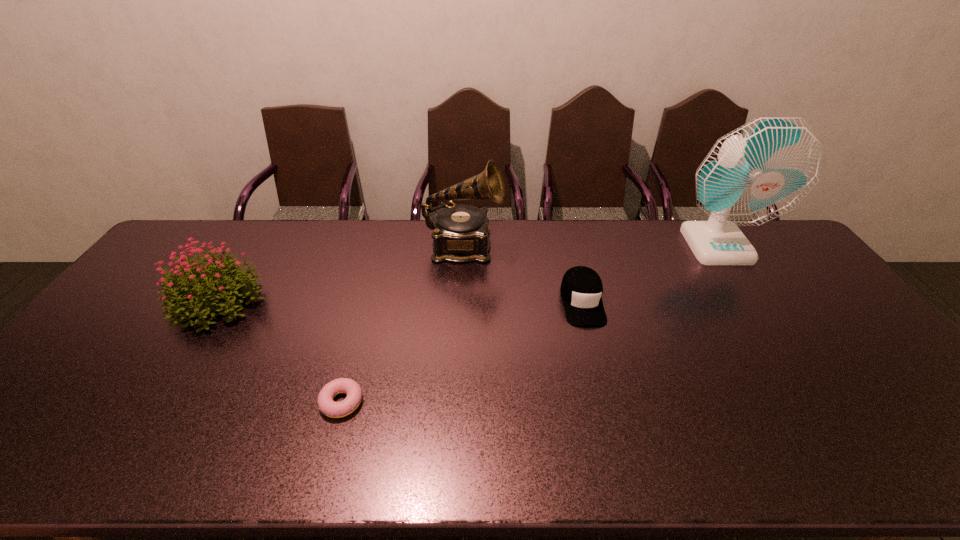
This screenshot has width=960, height=540. Identify the location of free space at the far edge of the desktop. (551, 243).

Locate an element on the screen. This screenshot has width=960, height=540. vacant region at the near edge of the desktop is located at coordinates (497, 447).

You are a GUI agent. You are given a task and a screenshot of the screen. Output one action in this format:
    pyautogui.click(x=<x>, y=<y>)
    Task: Click on the vacant space at the right edge of the desktop
    
    Given the screenshot: What is the action you would take?
    pyautogui.click(x=817, y=307)

In the image, there is a desktop. In order to click on vacant region at the far left corner in this screenshot , I will do `click(215, 244)`.

The height and width of the screenshot is (540, 960). In order to click on free space between the second object from left to right and the fourth shortest object in this screenshot , I will do `click(402, 325)`.

Where is `empty space that is in between the third tallest object and the fan`? Image resolution: width=960 pixels, height=540 pixels. empty space that is in between the third tallest object and the fan is located at coordinates (468, 273).

Where is `vacant region between the rightmost object and the second object from right to left`? The width and height of the screenshot is (960, 540). vacant region between the rightmost object and the second object from right to left is located at coordinates (649, 273).

This screenshot has height=540, width=960. In order to click on vacant point located between the third object from left to right and the tallest object in this screenshot , I will do `click(589, 246)`.

Find the location of a particular element. Image resolution: width=960 pixels, height=540 pixels. empty space between the third tallest object and the second shortest object is located at coordinates (400, 301).

At what (x,y) coordinates should I click in order to perform the action: click on vacant point located between the leftmost object and the phonograph record. Please return your answer as a coordinate pair (x, y). Looking at the image, I should click on coord(342,274).